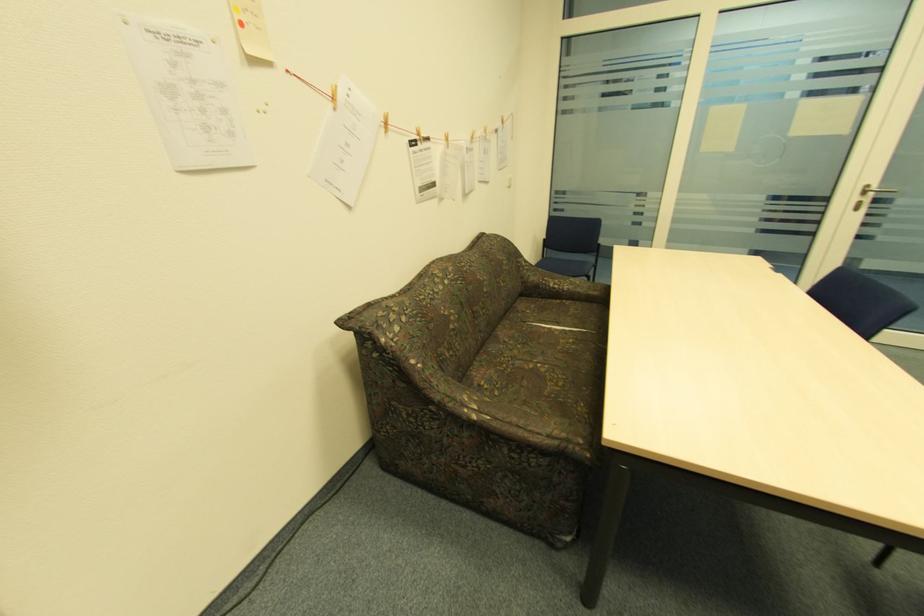
Where would you sit the sofa sitting surface? Please return your answer as a coordinate pair (x, y).

(552, 334)